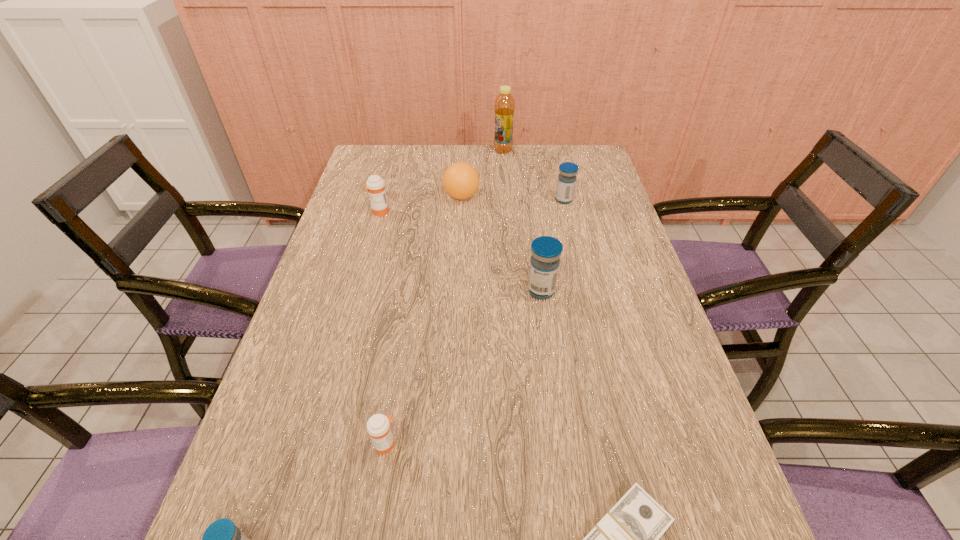
Locate which medicine ranks fourth in proximity to the bigger orange medicine. Please provide its 2D coordinates. Your answer should be formatted as a tuple, i.e. [(x, y)], where the tuple contains the x and y coordinates of a point satisfying the conditions above.

[(222, 539)]

At what (x,y) coordinates should I click in order to perform the action: click on medicine object that ranks as the third closest to the second smallest blue medicine. Please return your answer as a coordinate pair (x, y). Image resolution: width=960 pixels, height=540 pixels. Looking at the image, I should click on (378, 426).

Choose which blue medicine is the nearest neighbor to the smallest blue medicine. Please provide its 2D coordinates. Your answer should be formatted as a tuple, i.e. [(x, y)], where the tuple contains the x and y coordinates of a point satisfying the conditions above.

[(546, 251)]

Select which blue medicine is the closest to the fourth farthest medicine. Please provide its 2D coordinates. Your answer should be formatted as a tuple, i.e. [(x, y)], where the tuple contains the x and y coordinates of a point satisfying the conditions above.

[(222, 539)]

Find the location of a particular element. The image size is (960, 540). vacant area that satisfies the following two spatial constraints: 1. on the side with brand of the ping-pong ball; 2. on the back side of the rightmost blue medicine is located at coordinates (462, 200).

At what (x,y) coordinates should I click in order to perform the action: click on vacant point that satisfies the following two spatial constraints: 1. on the front side of the bottle; 2. on the right side of the farthest medicine. Please return your answer as a coordinate pair (x, y). This screenshot has width=960, height=540. Looking at the image, I should click on (507, 200).